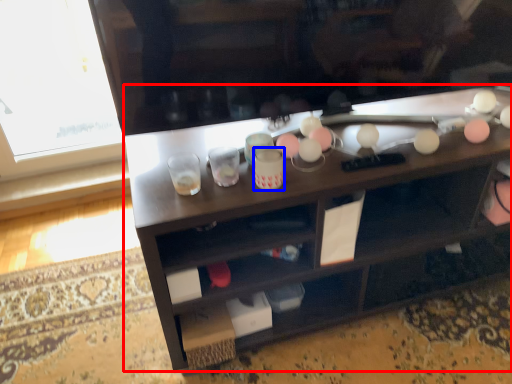
Question: Which of the following is the closest to the observer, desk (highlighted by a red box) or beverage (highlighted by a blue box)?

Choices:
 (A) desk
 (B) beverage

Answer: (A)